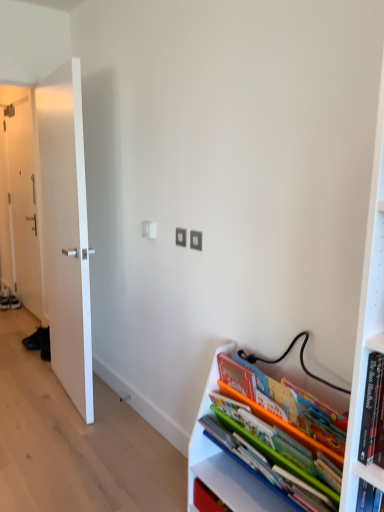
Question: Can you confirm if white matte door at left, the 1th door viewed from the back, is positioned to the left of matte plastic books at lower right?

Choices:
 (A) yes
 (B) no

Answer: (A)

Question: Does white matte door at left, the 2th door when ordered from front to back, have a greater height compared to matte plastic books at lower right?

Choices:
 (A) no
 (B) yes

Answer: (B)

Question: Considering the relative sizes of white matte door at left, acting as the first door starting from the left, and matte plastic books at lower right in the image provided, is white matte door at left, acting as the first door starting from the left, thinner than matte plastic books at lower right?

Choices:
 (A) yes
 (B) no

Answer: (A)

Question: From the image's perspective, is white matte door at left, placed as the 2th door when sorted from right to left, under matte plastic books at lower right?

Choices:
 (A) yes
 (B) no

Answer: (B)

Question: Considering the relative sizes of white matte door at left, acting as the first door starting from the left, and matte plastic books at lower right in the image provided, is white matte door at left, acting as the first door starting from the left, smaller than matte plastic books at lower right?

Choices:
 (A) no
 (B) yes

Answer: (A)

Question: From a real-world perspective, is white matte door at left, placed as the 2th door when sorted from right to left, over matte plastic books at lower right?

Choices:
 (A) yes
 (B) no

Answer: (A)

Question: Is matte plastic books at lower right to the right of white matte door at left, the 1th door viewed from the back, from the viewer's perspective?

Choices:
 (A) no
 (B) yes

Answer: (B)

Question: Would you say matte plastic books at lower right is outside white matte door at left, placed as the 2th door when sorted from right to left?

Choices:
 (A) no
 (B) yes

Answer: (B)

Question: From a real-world perspective, is matte plastic books at lower right located beneath white matte door at left, the 2th door when ordered from front to back?

Choices:
 (A) no
 (B) yes

Answer: (B)

Question: Is matte plastic books at lower right next to white matte door at left, placed as the 2th door when sorted from right to left, and touching it?

Choices:
 (A) no
 (B) yes

Answer: (A)

Question: From the image's perspective, is matte plastic books at lower right beneath white matte door at left, placed as the 2th door when sorted from right to left?

Choices:
 (A) yes
 (B) no

Answer: (A)

Question: Can you confirm if matte plastic books at lower right is wider than white matte door at left, acting as the first door starting from the left?

Choices:
 (A) no
 (B) yes

Answer: (B)

Question: Could you tell me if white smooth door at left, which is the second door in back-to-front order, is facing white matte door at left, the 2th door when ordered from front to back?

Choices:
 (A) no
 (B) yes

Answer: (A)